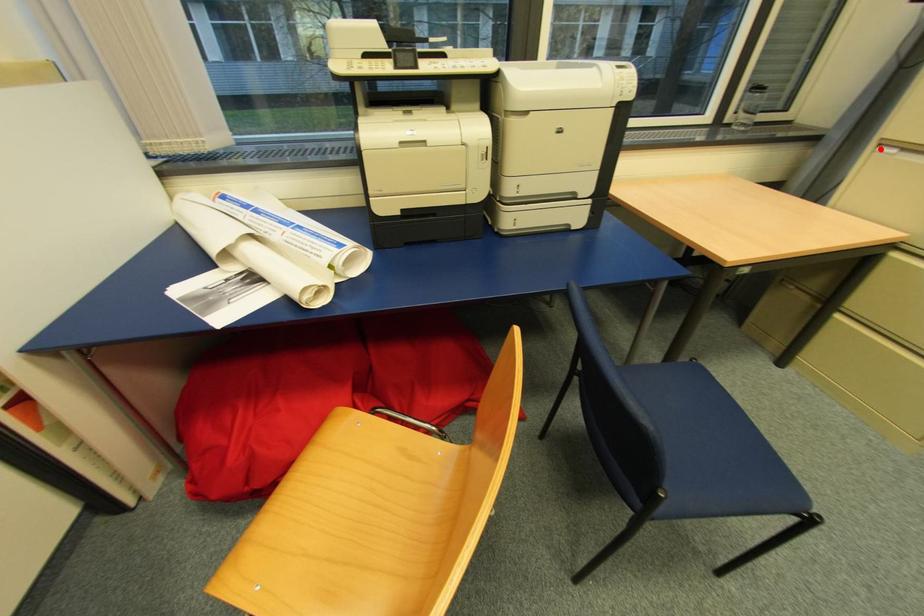
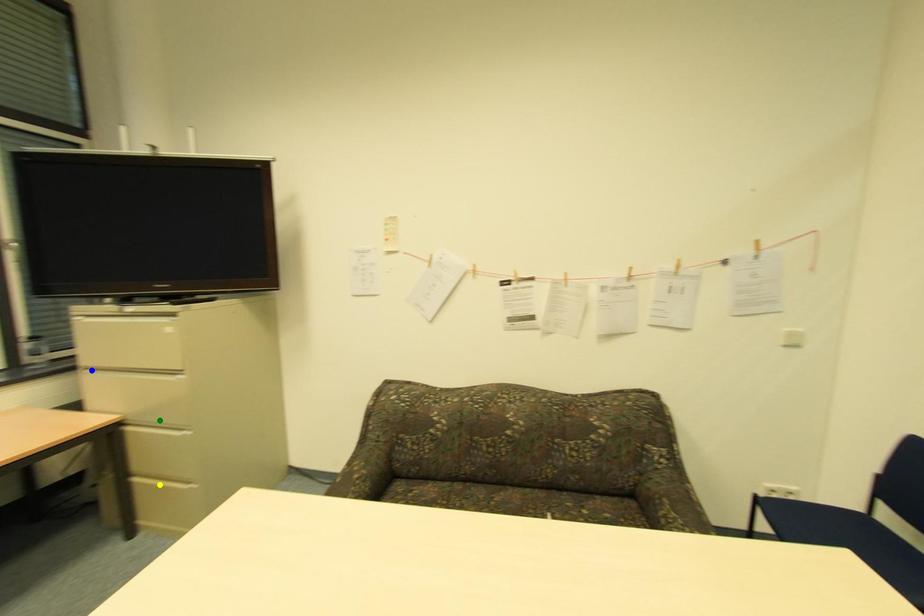
Question: I am providing you with two images of the same scene from different viewpoints. A red point is marked on the first image. You are given multiple points on the second image. Which point in image 2 is actually the same real-world point as the red point in image 1?

Choices:
 (A) green point
 (B) yellow point
 (C) blue point

Answer: (C)